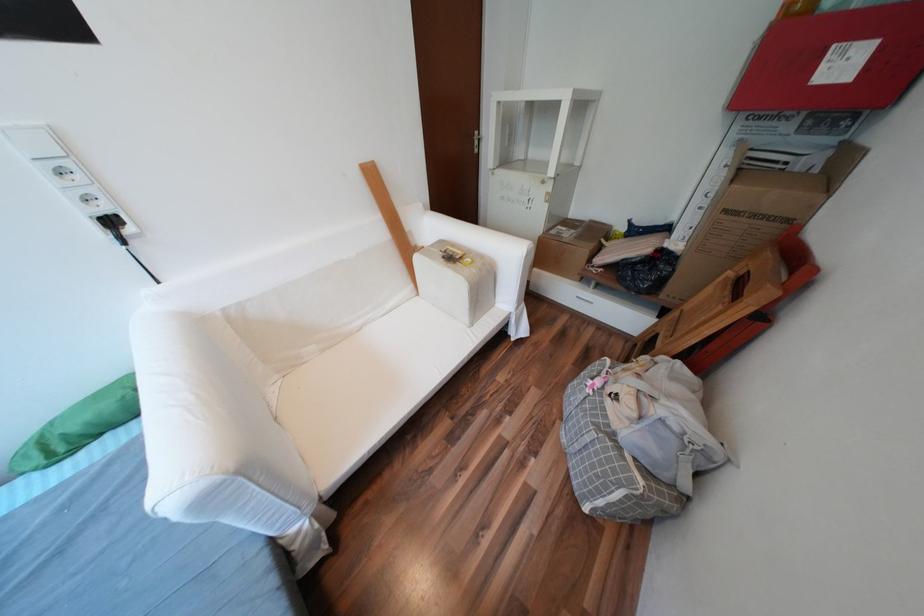
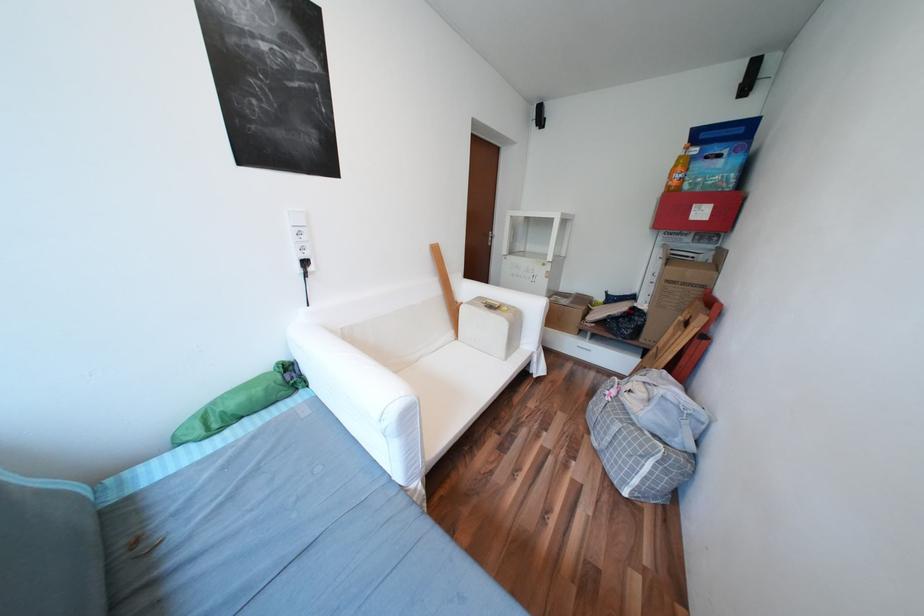
Question: Based on the continuous images, in which direction is the camera rotating? Reply with the corresponding letter.

Choices:
 (A) Left
 (B) Right
 (C) Up
 (D) Down

Answer: (C)